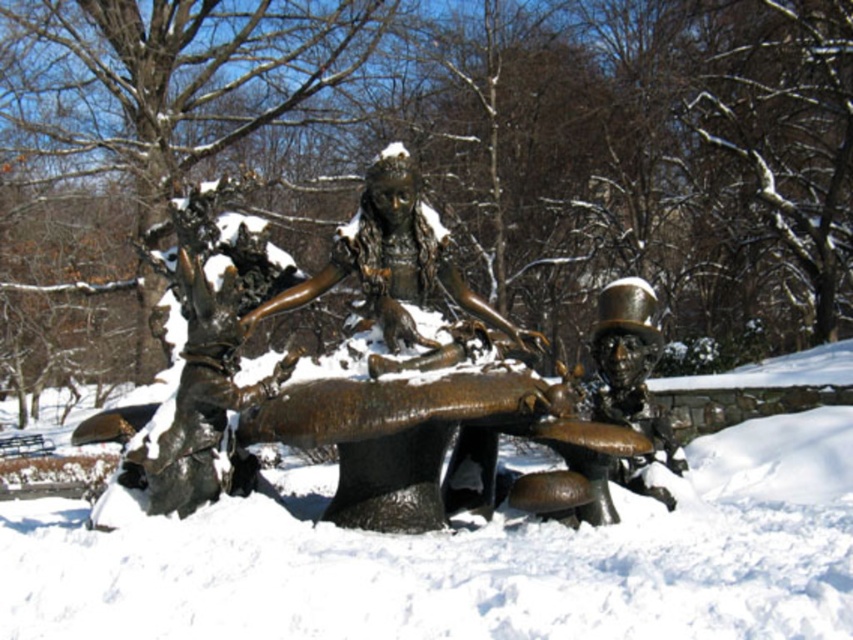
You are an art conservator assessing the sculpture. You notice the slightly frosted bronze table at center and the bronze statue at center. Which object is positioned lower in the scene?

The slightly frosted bronze table at center is below the bronze statue at center, so it is positioned lower in the scene.

Consider the image. You are standing at the entrance of the snowy area where the bronze sculpture is displayed. You need to place a small ornament exactly at the center of the slightly frosted bronze table at center. According to the coordinates provided, where should you aim to place the ornament?

The slightly frosted bronze table at center is located at point [466,561], so you should aim for those coordinates to place the ornament at its center.